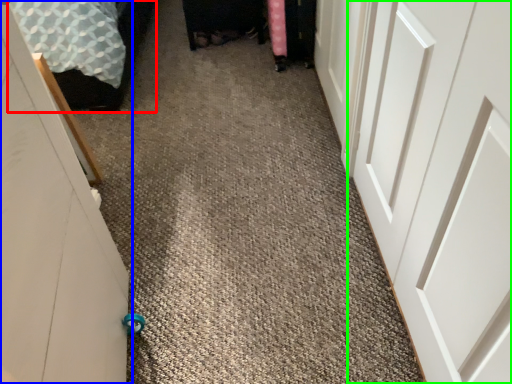
Question: Which object is positioned closest to bed (highlighted by a red box)? Select from door (highlighted by a blue box) and door (highlighted by a green box).

Choices:
 (A) door
 (B) door

Answer: (A)